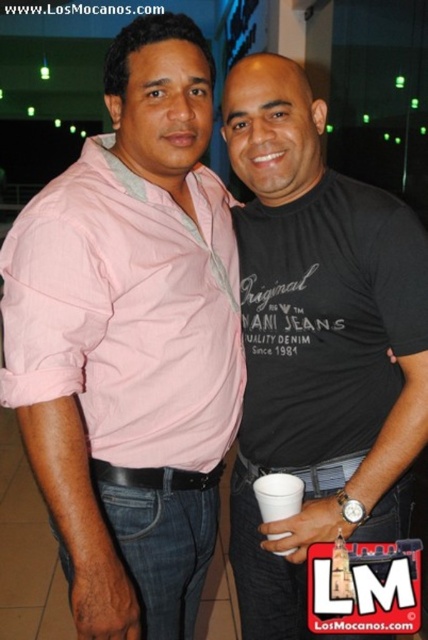
You are at a social event and see two points marked in the image. The first point is at coordinate point (x=157, y=580) and the second is at point (x=201, y=490). Which point is closer to you?

Point (x=157, y=580) is in front of point (x=201, y=490), so it is closer to you.